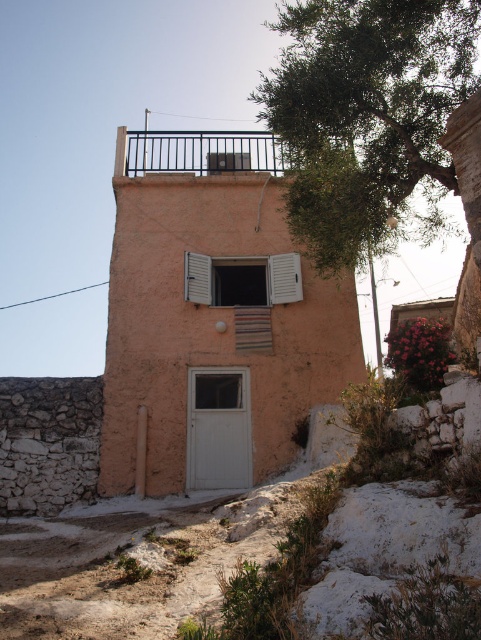
Question: Which object is closer to the camera taking this photo?

Choices:
 (A) green leafy tree at upper right
 (B) wooden at center
 (C) white matte window at center
 (D) black metal railing at upper center

Answer: (A)

Question: Which of the following is the farthest from the observer?

Choices:
 (A) (117, 156)
 (B) (232, 266)
 (C) (263, 342)
 (D) (189, 266)

Answer: (A)

Question: Is green leafy tree at upper right to the right of white matte window at center from the viewer's perspective?

Choices:
 (A) no
 (B) yes

Answer: (B)

Question: Does white matte window at center have a lesser width compared to white matte shutter at center?

Choices:
 (A) no
 (B) yes

Answer: (A)

Question: Which object is closer to the camera taking this photo?

Choices:
 (A) white matte window at center
 (B) green leafy tree at upper right
 (C) white matte shutter at center

Answer: (B)

Question: Is white matte window at center further to the viewer compared to white matte shutter at center?

Choices:
 (A) no
 (B) yes

Answer: (B)